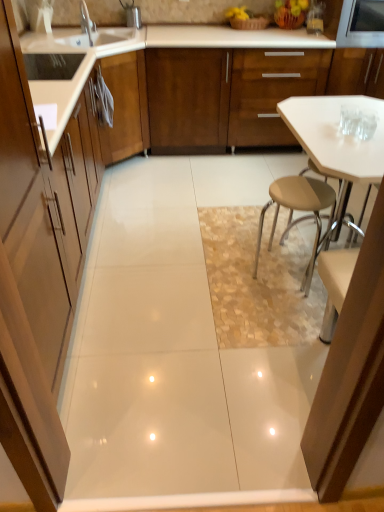
Question: Is silver metallic faucet at upper left at the back of matte wood cabinet at left, which is counted as the second cabinetry, starting from the right?

Choices:
 (A) no
 (B) yes

Answer: (A)

Question: Is matte wood cabinet at left, which ranks as the 1th cabinetry in left-to-right order, bigger than silver metallic faucet at upper left?

Choices:
 (A) yes
 (B) no

Answer: (A)

Question: Is matte wood cabinet at left, placed as the second cabinetry when sorted from back to front, wider than silver metallic faucet at upper left?

Choices:
 (A) yes
 (B) no

Answer: (A)

Question: Is matte wood cabinet at left, the first cabinetry when ordered from front to back, oriented towards silver metallic faucet at upper left?

Choices:
 (A) yes
 (B) no

Answer: (B)

Question: From a real-world perspective, is matte wood cabinet at left, which is counted as the first cabinetry, starting from the bottom, beneath silver metallic faucet at upper left?

Choices:
 (A) no
 (B) yes

Answer: (B)

Question: Considering the relative sizes of matte wood cabinet at left, the first cabinetry when ordered from front to back, and silver metallic faucet at upper left in the image provided, is matte wood cabinet at left, the first cabinetry when ordered from front to back, taller than silver metallic faucet at upper left?

Choices:
 (A) no
 (B) yes

Answer: (B)

Question: Is the depth of metallic stainless steel microwave at upper right less than that of silver metallic faucet at upper left?

Choices:
 (A) no
 (B) yes

Answer: (A)

Question: Can you confirm if metallic stainless steel microwave at upper right is smaller than silver metallic faucet at upper left?

Choices:
 (A) no
 (B) yes

Answer: (A)

Question: Is metallic stainless steel microwave at upper right to the right of silver metallic faucet at upper left from the viewer's perspective?

Choices:
 (A) no
 (B) yes

Answer: (B)

Question: Is metallic stainless steel microwave at upper right facing away from silver metallic faucet at upper left?

Choices:
 (A) yes
 (B) no

Answer: (B)

Question: Considering the relative sizes of metallic stainless steel microwave at upper right and silver metallic faucet at upper left in the image provided, is metallic stainless steel microwave at upper right bigger than silver metallic faucet at upper left?

Choices:
 (A) yes
 (B) no

Answer: (A)

Question: From a real-world perspective, is metallic stainless steel microwave at upper right on silver metallic faucet at upper left?

Choices:
 (A) no
 (B) yes

Answer: (A)

Question: Can you confirm if silver metallic faucet at upper left is bigger than matte wood cabinet at left, which is counted as the first cabinetry, starting from the bottom?

Choices:
 (A) no
 (B) yes

Answer: (A)